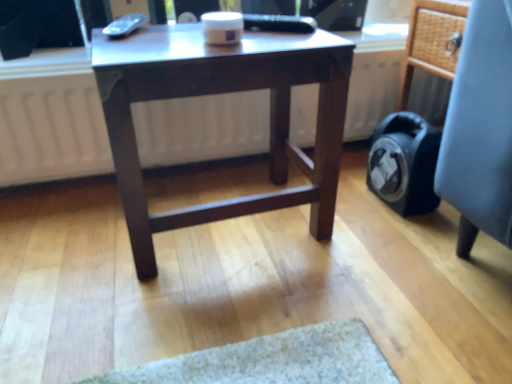
At what (x,y) coordinates should I click in order to perform the action: click on vacant region to the left of dark brown wood table at center. Please return your answer as a coordinate pair (x, y). Looking at the image, I should click on (73, 239).